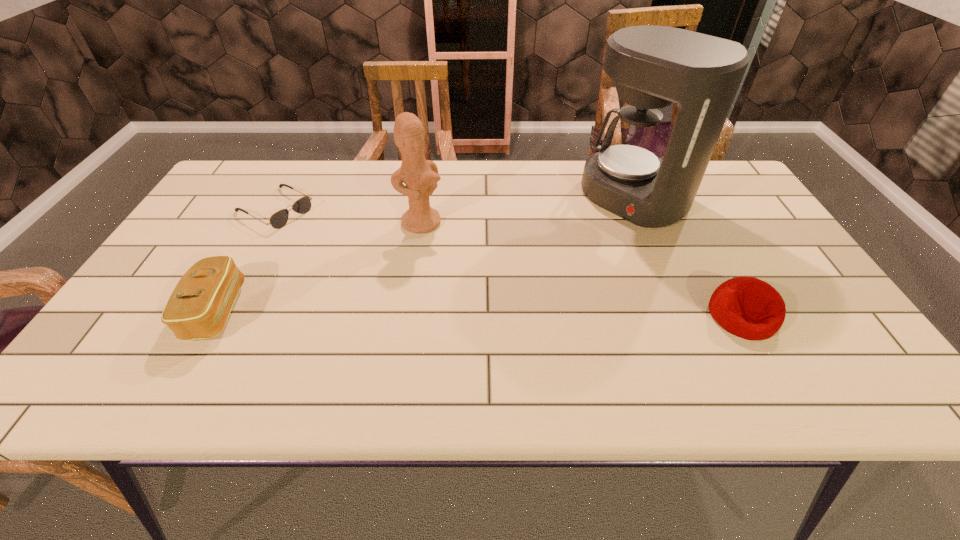
Locate an element on the screen. The height and width of the screenshot is (540, 960). vacant region located 0.280m on the front-facing side of the figurine is located at coordinates 493,299.

This screenshot has height=540, width=960. What are the coordinates of `vacant area situated on the front-facing side of the figurine` in the screenshot? It's located at (463, 267).

Locate an element on the screen. This screenshot has width=960, height=540. vacant space situated 0.060m on the front-facing side of the figurine is located at coordinates (444, 247).

At what (x,y) coordinates should I click in order to perform the action: click on blank space located on the front-facing side of the coffee maker. Please return your answer as a coordinate pair (x, y). Looking at the image, I should click on (551, 261).

The width and height of the screenshot is (960, 540). What are the coordinates of `vacant space located on the front-facing side of the coffee maker` in the screenshot? It's located at (513, 289).

At what (x,y) coordinates should I click in order to perform the action: click on free spot located on the front-facing side of the coffee maker. Please return your answer as a coordinate pair (x, y). This screenshot has width=960, height=540. Looking at the image, I should click on (543, 266).

At what (x,y) coordinates should I click in order to perform the action: click on sunglasses located in the far edge section of the desktop. Please return your answer as a coordinate pair (x, y). The height and width of the screenshot is (540, 960). Looking at the image, I should click on (279, 219).

The width and height of the screenshot is (960, 540). I want to click on coffee maker at the far edge, so pos(653,66).

Identify the location of clutch bag that is positioned at the near edge. (198, 308).

This screenshot has height=540, width=960. Find the location of `beanbag that is at the near edge`. beanbag that is at the near edge is located at coordinates (747, 307).